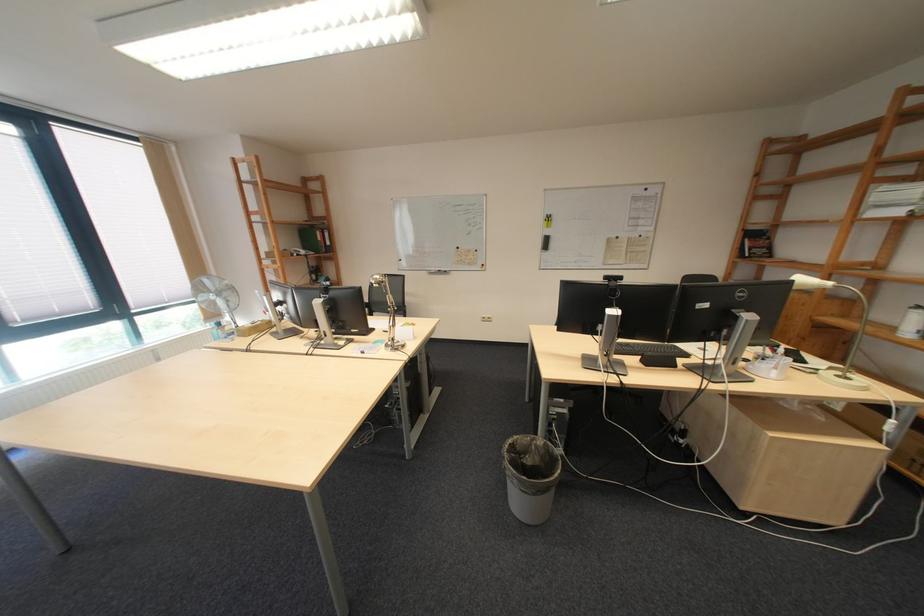
The height and width of the screenshot is (616, 924). I want to click on silver lamp head, so click(x=811, y=283).